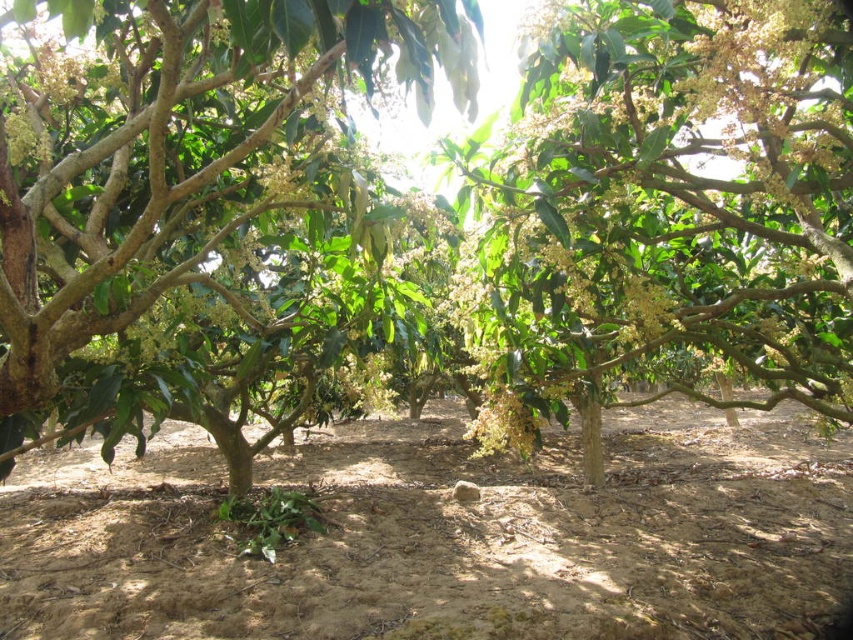
Is brown soil at center thinner than green glossy tree at upper center?

Yes, brown soil at center is thinner than green glossy tree at upper center.

Does brown soil at center have a larger size compared to green glossy tree at upper center?

Actually, brown soil at center might be smaller than green glossy tree at upper center.

Which is behind, point (375, 515) or point (793, 264)?

Point (375, 515)

Where is `brown soil at center`? The image size is (853, 640). brown soil at center is located at coordinates (445, 536).

Image resolution: width=853 pixels, height=640 pixels. Describe the element at coordinates (189, 198) in the screenshot. I see `green leafy tree at center` at that location.

Does green leafy tree at center have a larger size compared to green glossy tree at upper center?

Indeed, green leafy tree at center has a larger size compared to green glossy tree at upper center.

What do you see at coordinates (189, 198) in the screenshot? This screenshot has width=853, height=640. I see `green leafy tree at center` at bounding box center [189, 198].

Locate an element on the screen. The image size is (853, 640). green leafy tree at center is located at coordinates (189, 198).

Does brown soil at center appear on the left side of green leafy tree at center?

No, brown soil at center is not to the left of green leafy tree at center.

Is the position of brown soil at center more distant than that of green leafy tree at center?

Yes, it is.

Is point (341, 586) less distant than point (64, 182)?

No, (341, 586) is further to viewer.

You are a GUI agent. You are given a task and a screenshot of the screen. Output one action in this format:
    pyautogui.click(x=<x>, y=<y>)
    Task: Click on the brown soil at center
    
    Given the screenshot: What is the action you would take?
    445,536